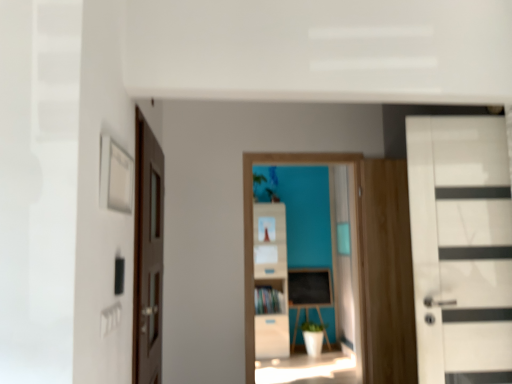
I want to click on brown wooden door at left, the second door viewed from the right, so click(148, 256).

Locate an element on the screen. Image resolution: width=512 pixels, height=384 pixels. white glossy door at right, placed as the 1th door when sorted from right to left is located at coordinates (461, 248).

What do you see at coordinates (270, 281) in the screenshot? This screenshot has width=512, height=384. I see `wooden file cabinet at center` at bounding box center [270, 281].

The width and height of the screenshot is (512, 384). Describe the element at coordinates (308, 293) in the screenshot. I see `blackboard at center` at that location.

You are a GUI agent. You are given a task and a screenshot of the screen. Output one action in this format:
    pyautogui.click(x=<x>, y=<y>)
    Task: Click on the brown wooden door at left, the second door viewed from the right
    The width and height of the screenshot is (512, 384).
    Given the screenshot: What is the action you would take?
    pyautogui.click(x=148, y=256)

Which is in front, brown wooden door at left, placed as the first door when sorted from left to right, or wooden file cabinet at center?

brown wooden door at left, placed as the first door when sorted from left to right.

In the scene shown: Is brown wooden door at left, the second door viewed from the right, with wooden file cabinet at center?

No, brown wooden door at left, the second door viewed from the right, is not beside wooden file cabinet at center.

Does brown wooden door at left, the second door viewed from the right, have a greater width compared to wooden file cabinet at center?

No.

Is wooden cabinet at center further to the viewer compared to brown wooden door at left, the second door viewed from the right?

Yes, wooden cabinet at center is further from the camera.

From the image's perspective, is wooden cabinet at center above brown wooden door at left, the second door viewed from the right?

Incorrect, from the image's perspective, wooden cabinet at center is lower than brown wooden door at left, the second door viewed from the right.

How much distance is there between wooden cabinet at center and brown wooden door at left, placed as the first door when sorted from left to right?

wooden cabinet at center and brown wooden door at left, placed as the first door when sorted from left to right, are 3.69 meters apart from each other.

Which of these two, wooden cabinet at center or brown wooden door at left, the second door viewed from the right, is thinner?

brown wooden door at left, the second door viewed from the right.

Which object is thinner, wooden file cabinet at center or blackboard at center?

Thinner between the two is blackboard at center.

Measure the distance from wooden file cabinet at center to blackboard at center.

wooden file cabinet at center and blackboard at center are 22.42 inches apart.

Is the surface of wooden file cabinet at center in direct contact with blackboard at center?

There is a gap between wooden file cabinet at center and blackboard at center.

Between wooden file cabinet at center and blackboard at center, which one has less height?

With less height is blackboard at center.

Based on the photo, does white glossy door at right, placed as the 1th door when sorted from right to left, lie behind wooden cabinet at center?

No, white glossy door at right, placed as the 1th door when sorted from right to left, is closer to the camera.

Is point (437, 237) in front of point (279, 300)?

Yes, point (437, 237) is in front of point (279, 300).

What's the angular difference between white glossy door at right, the second door when ordered from left to right, and wooden cabinet at center's facing directions?

white glossy door at right, the second door when ordered from left to right, and wooden cabinet at center are facing 172 degrees away from each other.

From the image's perspective, which one is positioned higher, white glossy door at right, the second door when ordered from left to right, or wooden cabinet at center?

white glossy door at right, the second door when ordered from left to right, appears higher in the image.

Which object is positioned more to the left, brown wooden door at left, the second door viewed from the right, or white glossy door at right, the second door when ordered from left to right?

From the viewer's perspective, brown wooden door at left, the second door viewed from the right, appears more on the left side.

Is brown wooden door at left, the second door viewed from the right, oriented away from white glossy door at right, the second door when ordered from left to right?

That's not correct — brown wooden door at left, the second door viewed from the right, is not looking away from white glossy door at right, the second door when ordered from left to right.

In the image, is brown wooden door at left, the second door viewed from the right, positioned in front of or behind white glossy door at right, the second door when ordered from left to right?

Clearly, brown wooden door at left, the second door viewed from the right, is in front of white glossy door at right, the second door when ordered from left to right.

Is point (139, 147) closer to viewer compared to point (472, 203)?

No, it is not.

Can you see white glossy door at right, the second door when ordered from left to right, touching wooden file cabinet at center?

No, white glossy door at right, the second door when ordered from left to right, is not with wooden file cabinet at center.

Is white glossy door at right, the second door when ordered from left to right, positioned beyond the bounds of wooden file cabinet at center?

Yes, white glossy door at right, the second door when ordered from left to right, is outside of wooden file cabinet at center.

From the image's perspective, is white glossy door at right, placed as the 1th door when sorted from right to left, positioned above or below wooden file cabinet at center?

From the image's perspective, white glossy door at right, placed as the 1th door when sorted from right to left, appears above wooden file cabinet at center.

What's the angular difference between white glossy door at right, placed as the 1th door when sorted from right to left, and wooden file cabinet at center's facing directions?

The facing directions of white glossy door at right, placed as the 1th door when sorted from right to left, and wooden file cabinet at center are 174 degrees apart.

Does point (302, 296) come closer to viewer compared to point (445, 349)?

No, (302, 296) is further to viewer.

Looking at this image, how many degrees apart are the facing directions of blackboard at center and white glossy door at right, placed as the 1th door when sorted from right to left?

174 degrees.

Measure the distance from blackboard at center to white glossy door at right, placed as the 1th door when sorted from right to left.

blackboard at center and white glossy door at right, placed as the 1th door when sorted from right to left, are 4.35 meters apart from each other.

Consider the image. Is blackboard at center bigger than white glossy door at right, the second door when ordered from left to right?

Incorrect, blackboard at center is not larger than white glossy door at right, the second door when ordered from left to right.

The image size is (512, 384). I want to click on file cabinet behind the brown wooden door at left, the second door viewed from the right, so click(270, 281).

The width and height of the screenshot is (512, 384). I want to click on cabinet that appears on the right of brown wooden door at left, the second door viewed from the right, so click(269, 297).

Estimate the real-world distances between objects in this image. Which object is closer to brown wooden door at left, the second door viewed from the right, white glossy door at right, placed as the 1th door when sorted from right to left, or wooden cabinet at center?

Among the two, white glossy door at right, placed as the 1th door when sorted from right to left, is located nearer to brown wooden door at left, the second door viewed from the right.

Based on their spatial positions, is brown wooden door at left, the second door viewed from the right, or wooden cabinet at center closer to blackboard at center?

wooden cabinet at center.

Looking at the image, which one is located closer to white glossy door at right, the second door when ordered from left to right, brown wooden door at left, the second door viewed from the right, or wooden cabinet at center?

The object closer to white glossy door at right, the second door when ordered from left to right, is brown wooden door at left, the second door viewed from the right.

From the image, which object appears to be nearer to brown wooden door at left, placed as the first door when sorted from left to right, wooden cabinet at center or wooden file cabinet at center?

wooden file cabinet at center.

Considering their positions, is blackboard at center positioned further to white glossy door at right, placed as the 1th door when sorted from right to left, than wooden file cabinet at center?

Based on the image, blackboard at center appears to be further to white glossy door at right, placed as the 1th door when sorted from right to left.

When comparing their distances from brown wooden door at left, placed as the first door when sorted from left to right, does blackboard at center or white glossy door at right, placed as the 1th door when sorted from right to left, seem further?

→ The object further to brown wooden door at left, placed as the first door when sorted from left to right, is blackboard at center.

Estimate the real-world distances between objects in this image. Which object is closer to wooden file cabinet at center, wooden cabinet at center or brown wooden door at left, placed as the first door when sorted from left to right?

wooden cabinet at center is positioned closer to the anchor wooden file cabinet at center.

Estimate the real-world distances between objects in this image. Which object is further from white glossy door at right, the second door when ordered from left to right, brown wooden door at left, the second door viewed from the right, or blackboard at center?

blackboard at center is positioned further to the anchor white glossy door at right, the second door when ordered from left to right.

Find the location of a particular element. file cabinet located between brown wooden door at left, placed as the first door when sorted from left to right, and blackboard at center in the depth direction is located at coordinates (270, 281).

I want to click on file cabinet between white glossy door at right, the second door when ordered from left to right, and wooden cabinet at center in the front-back direction, so click(270, 281).

The height and width of the screenshot is (384, 512). What are the coordinates of `file cabinet between wooden cabinet at center and blackboard at center` in the screenshot? It's located at (270, 281).

Where is `cabinet between white glossy door at right, the second door when ordered from left to right, and blackboard at center, along the z-axis`? This screenshot has width=512, height=384. cabinet between white glossy door at right, the second door when ordered from left to right, and blackboard at center, along the z-axis is located at coordinates (269, 297).